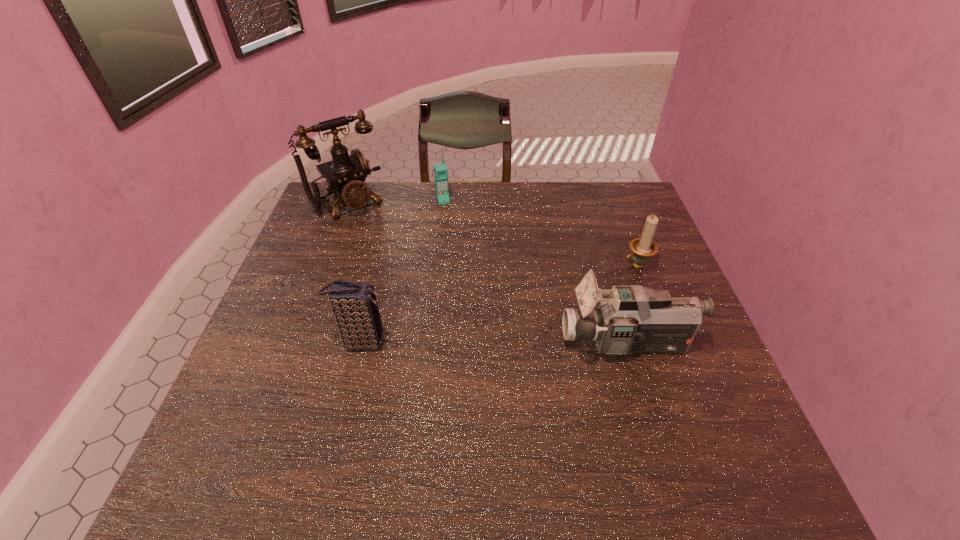
This screenshot has height=540, width=960. What are the coordinates of `free space located on the handle side of the third nearest object` in the screenshot? It's located at (575, 293).

Locate an element on the screen. vacant position located on the handle side of the third nearest object is located at coordinates (565, 297).

Locate an element on the screen. The height and width of the screenshot is (540, 960). free space located 0.200m on the keypad of the cellular telephone is located at coordinates (458, 244).

Image resolution: width=960 pixels, height=540 pixels. Identify the location of vacant region located 0.140m on the keypad of the cellular telephone. (453, 232).

Where is `vacant region located on the keypad of the cellular telephone`? This screenshot has width=960, height=540. vacant region located on the keypad of the cellular telephone is located at coordinates (454, 233).

Image resolution: width=960 pixels, height=540 pixels. In order to click on free location located 0.120m on the rotary dial of the telephone in this screenshot , I will do `click(382, 239)`.

Identify the location of free spot located on the rotary dial of the telephone. This screenshot has width=960, height=540. (376, 232).

This screenshot has width=960, height=540. I want to click on free spot located 0.100m on the rotary dial of the telephone, so click(379, 235).

The image size is (960, 540). Identify the location of cellular telephone that is at the far edge. (440, 169).

In order to click on telephone located at the far edge in this screenshot , I will do `click(345, 174)`.